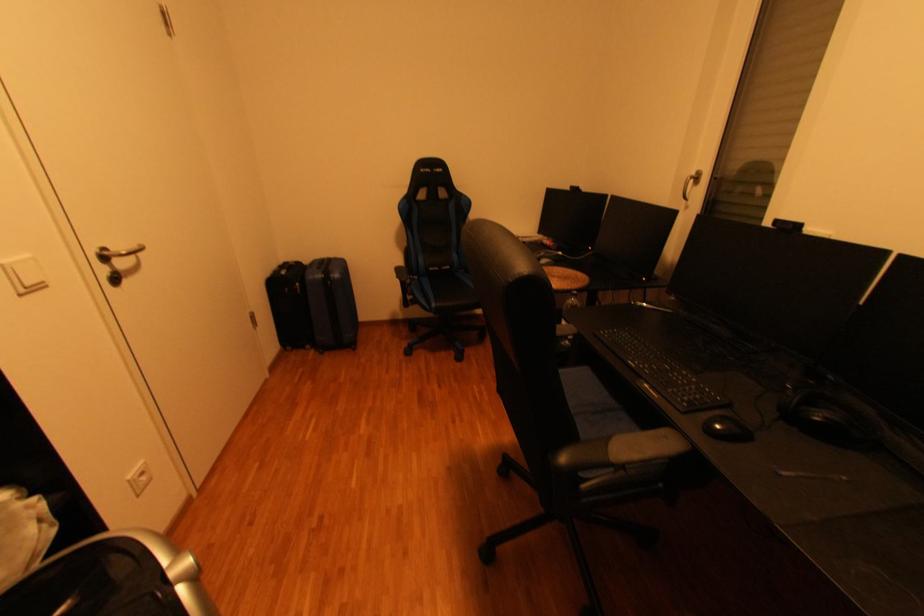
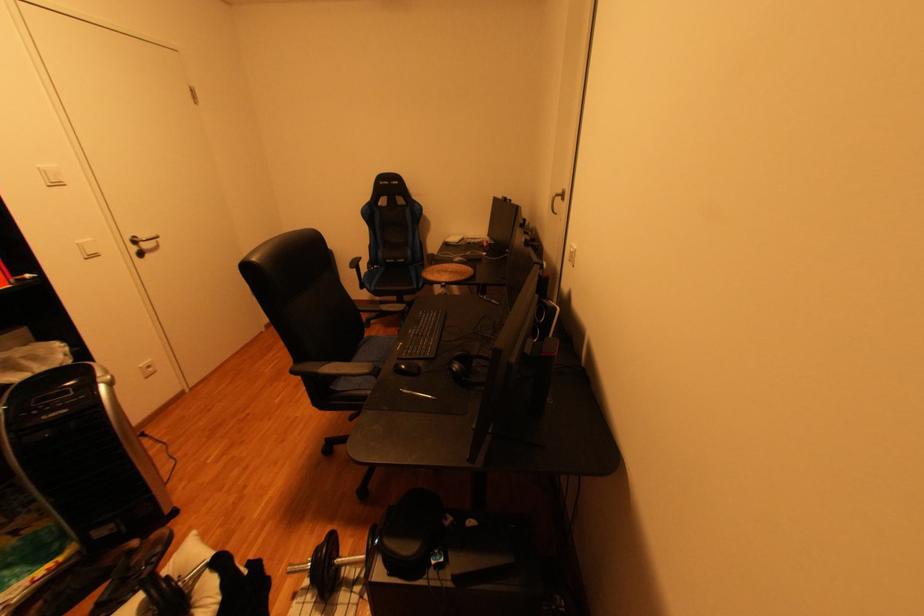
The point at (122, 268) is marked in the first image. Where is the corresponding point in the second image?

(150, 248)